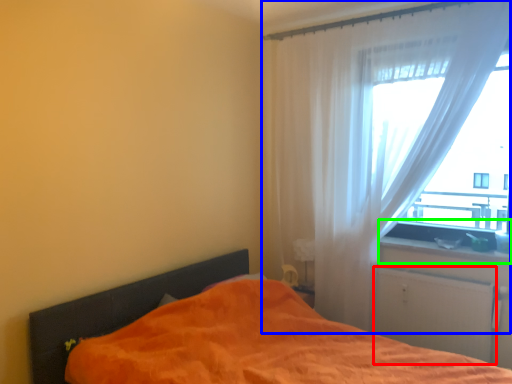
Question: Considering the real-world distances, which object is closest to screen door (highlighted by a red box)? curtain (highlighted by a blue box) or window sill (highlighted by a green box).

Choices:
 (A) curtain
 (B) window sill

Answer: (B)